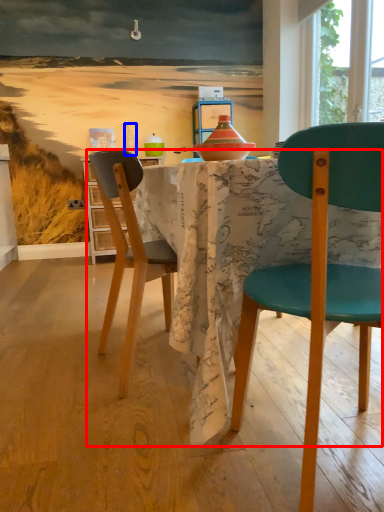
Question: Which object appears closest to the camera in this image, kitchen & dining room table (highlighted by a red box) or bottle (highlighted by a blue box)?

Choices:
 (A) kitchen & dining room table
 (B) bottle

Answer: (A)